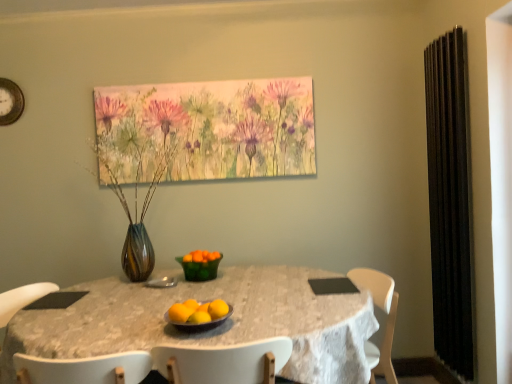
Image resolution: width=512 pixels, height=384 pixels. I want to click on blank space situated above watercolor flowers at upper center (from a real-world perspective), so click(x=205, y=77).